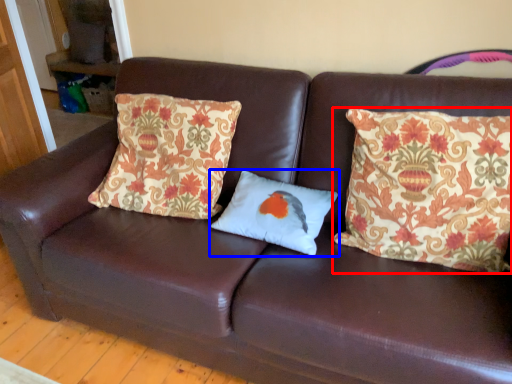
Question: Which of the following is the farthest to the observer, pillow (highlighted by a red box) or pillow (highlighted by a blue box)?

Choices:
 (A) pillow
 (B) pillow

Answer: (B)